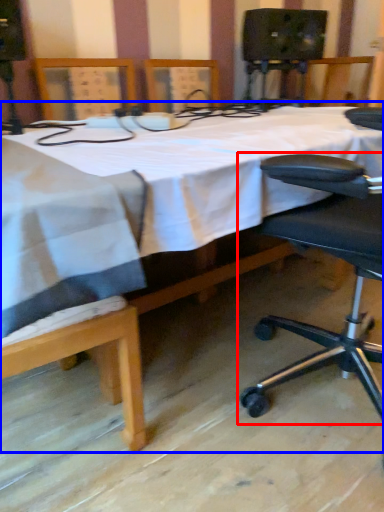
Question: Among these objects, which one is farthest to the camera, chair (highlighted by a red box) or table (highlighted by a blue box)?

Choices:
 (A) chair
 (B) table

Answer: (A)